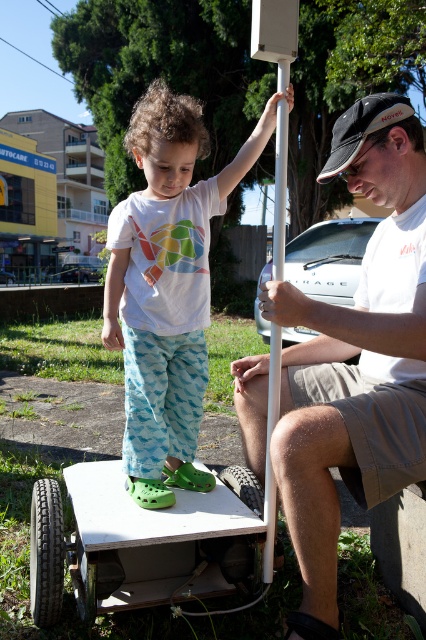
Locate an element on the screen. This screenshot has height=640, width=426. white matte pole at center is located at coordinates (359, 358).

Who is more distant from viewer, [328,592] or [267,109]?

The point [267,109] is more distant.

Identify the location of white matte pole at center. The height and width of the screenshot is (640, 426). (359, 358).

Can you confirm if white cotton shirt at center is wider than white plastic pole at center?

Yes, white cotton shirt at center is wider than white plastic pole at center.

Between white cotton shirt at center and white plastic pole at center, which one appears on the right side from the viewer's perspective?

white plastic pole at center is more to the right.

Who is more forward, (126, 353) or (276, 164)?

Point (276, 164) is in front.

Image resolution: width=426 pixels, height=640 pixels. I want to click on white cotton shirt at center, so click(166, 288).

Between white matte pole at center and white plastic pole at center, which one appears on the left side from the viewer's perspective?

white plastic pole at center

Is white matte pole at center above white plastic pole at center?

Correct, white matte pole at center is located above white plastic pole at center.

In order to click on white matte pole at center in this screenshot , I will do `click(359, 358)`.